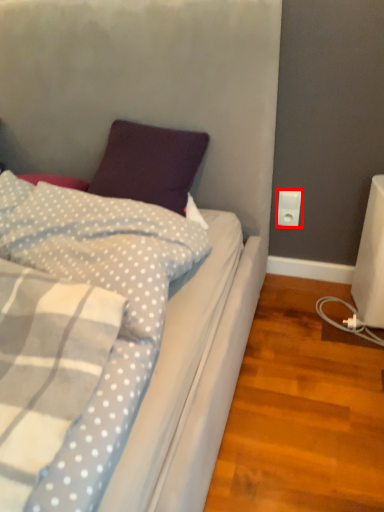
Question: From the image's perspective, considering the relative positions of power plugs and sockets (annotated by the red box) and pillow in the image provided, where is power plugs and sockets (annotated by the red box) located with respect to the staircase?

Choices:
 (A) above
 (B) below

Answer: (A)